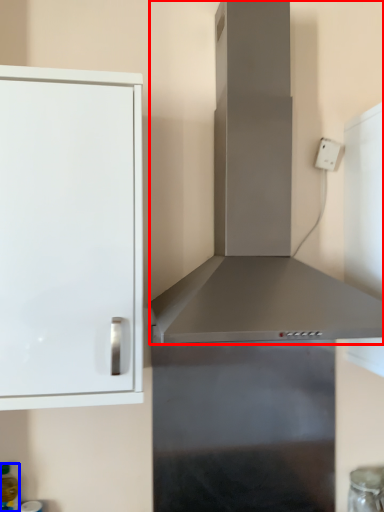
Question: Among these objects, which one is nearest to the camera, vent (highlighted by a red box) or bottle (highlighted by a blue box)?

Choices:
 (A) vent
 (B) bottle

Answer: (A)